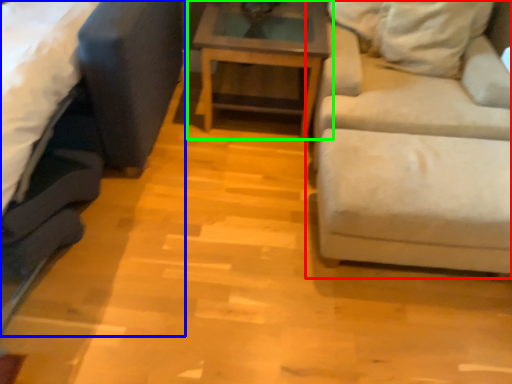
Question: Which is nearer to the studio couch (highlighted by a red box)? studio couch (highlighted by a blue box) or table (highlighted by a green box).

Choices:
 (A) studio couch
 (B) table

Answer: (B)